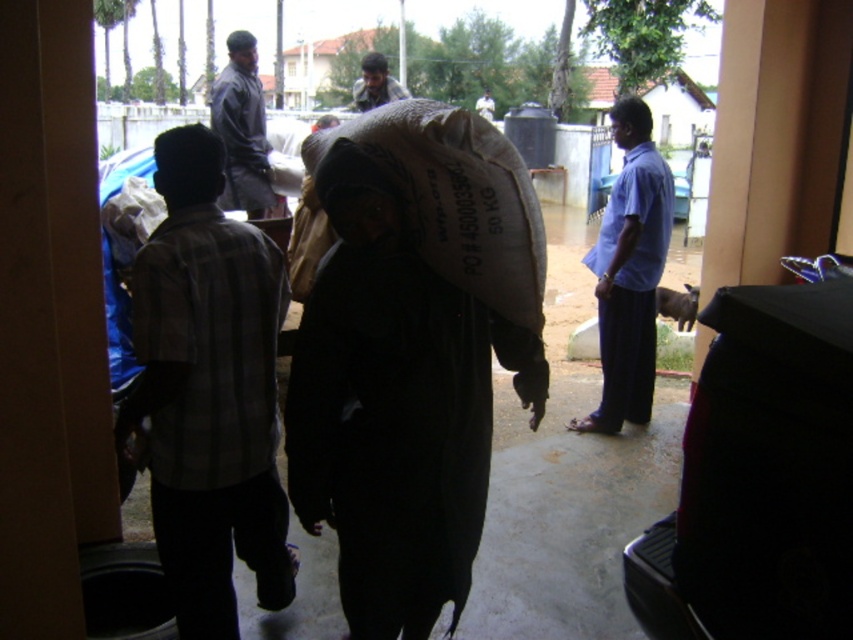
You are a delivery person who needs to locate the dark gray fabric bag at center. From your current position, which direction should you move to reach it first, considering the dark blue shirt at upper left is blocking your view?

The dark blue shirt at upper left is in front of the dark gray fabric bag at center, so you should move to the side of the dark blue shirt at upper left to get a clear path to the dark gray fabric bag at center.

You are a delivery person who needs to deliver a package. You observe the dark blue shirt at upper left and the dark gray fabric bag at center in the scene. Which object is closer to the ground?

The dark blue shirt at upper left is shorter than the dark gray fabric bag at center, so the dark blue shirt at upper left is closer to the ground.

You are a delivery person observing two workers in the scene. One is wearing a plaid cotton shirt at center and the other a dark blue shirt at center. Based on their height, which worker might need a taller ladder to reach a high shelf?

The dark blue shirt at center is taller than the plaid cotton shirt at center, so the dark blue shirt at center would need a taller ladder to reach the high shelf.